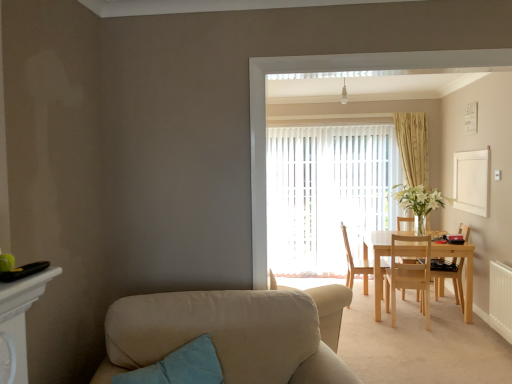
Question: From the image's perspective, is white vertical blinds at center on light wood table at center?

Choices:
 (A) no
 (B) yes

Answer: (B)

Question: Is light wood table at center completely or partially inside white vertical blinds at center?

Choices:
 (A) yes
 (B) no

Answer: (B)

Question: Does white vertical blinds at center turn towards light wood table at center?

Choices:
 (A) no
 (B) yes

Answer: (B)

Question: Does white vertical blinds at center have a lesser width compared to light wood table at center?

Choices:
 (A) no
 (B) yes

Answer: (B)

Question: Can you confirm if white vertical blinds at center is smaller than light wood table at center?

Choices:
 (A) no
 (B) yes

Answer: (A)

Question: In the image, is light wood table at center positioned in front of or behind white textured radiator at lower right?

Choices:
 (A) front
 (B) behind

Answer: (B)

Question: From the image's perspective, is light wood table at center located above or below white textured radiator at lower right?

Choices:
 (A) above
 (B) below

Answer: (A)

Question: Is point (377, 291) positioned closer to the camera than point (507, 317)?

Choices:
 (A) farther
 (B) closer

Answer: (A)

Question: Choose the correct answer: Is light wood table at center inside white textured radiator at lower right or outside it?

Choices:
 (A) outside
 (B) inside

Answer: (A)

Question: Do you think light wood table at center is within teal fabric pillow at lower left, or outside of it?

Choices:
 (A) inside
 (B) outside

Answer: (B)

Question: Looking at the image, does light wood table at center seem bigger or smaller compared to teal fabric pillow at lower left?

Choices:
 (A) big
 (B) small

Answer: (A)

Question: Considering the positions of light wood table at center and teal fabric pillow at lower left in the image, is light wood table at center wider or thinner than teal fabric pillow at lower left?

Choices:
 (A) thin
 (B) wide

Answer: (B)

Question: Is point (432, 254) positioned closer to the camera than point (126, 382)?

Choices:
 (A) farther
 (B) closer

Answer: (A)

Question: Is point (346, 236) closer or farther from the camera than point (198, 367)?

Choices:
 (A) closer
 (B) farther

Answer: (B)

Question: Would you say light wood chair at center, the 3th chair when ordered from right to left, is inside or outside teal fabric pillow at lower left?

Choices:
 (A) inside
 (B) outside

Answer: (B)